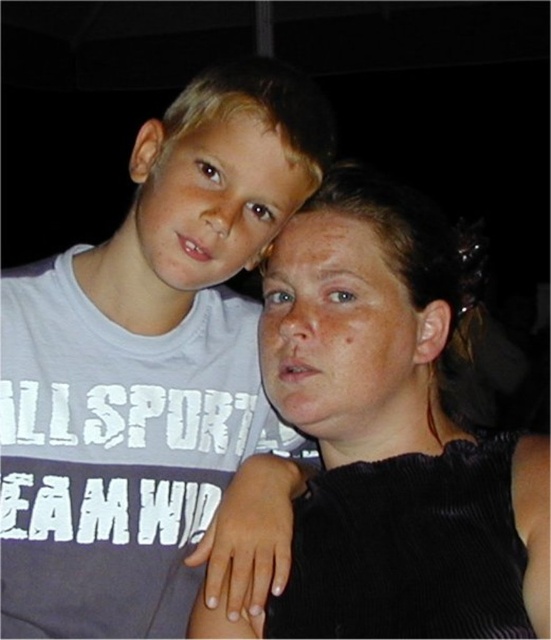
Question: Is black corduroy top at center below dry skin face at center?

Choices:
 (A) no
 (B) yes

Answer: (B)

Question: Considering the real-world distances, which object is farthest from the matte gray t-shirt at left?

Choices:
 (A) smooth skin face at upper left
 (B) dry skin face at center
 (C) black corduroy top at center

Answer: (B)

Question: Does black corduroy top at center have a larger size compared to dry skin face at center?

Choices:
 (A) yes
 (B) no

Answer: (A)

Question: Which point is closer to the camera?

Choices:
 (A) smooth skin face at upper left
 (B) black corduroy top at center
 (C) dry skin face at center
 (D) matte gray t-shirt at left

Answer: (B)

Question: Does dry skin face at center appear on the right side of smooth skin face at upper left?

Choices:
 (A) yes
 (B) no

Answer: (A)

Question: Which of the following is the closest to the observer?

Choices:
 (A) (446, 252)
 (B) (148, 160)
 (C) (368, 225)
 (D) (41, 561)

Answer: (C)